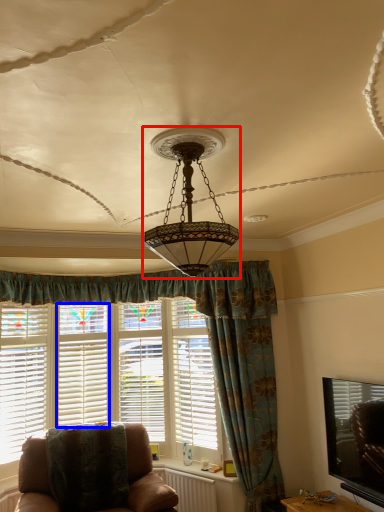
Question: Which object is closer to the camera taking this photo, lamp (highlighted by a red box) or window frame (highlighted by a blue box)?

Choices:
 (A) lamp
 (B) window frame

Answer: (A)